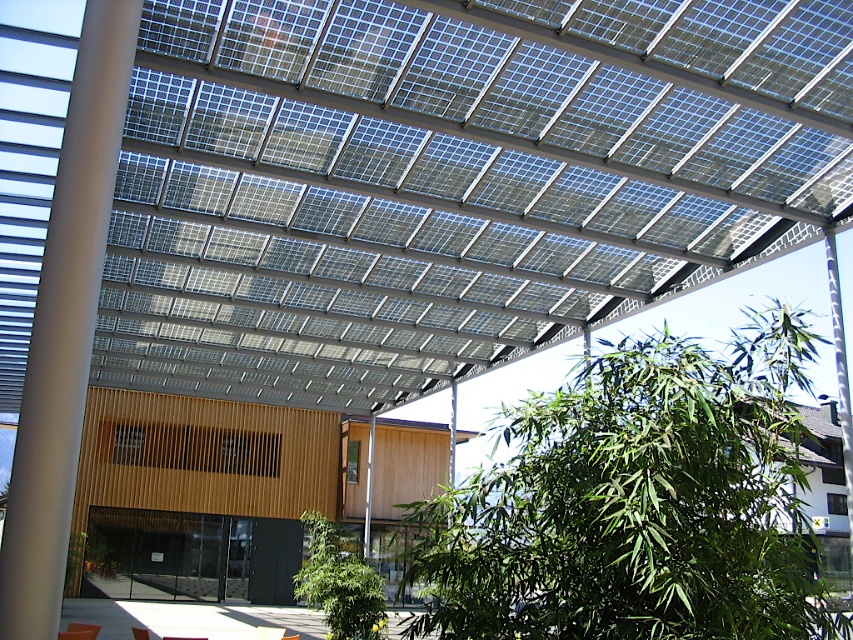
Is point (329, 356) positioned after point (363, 611)?

Yes, point (329, 356) is behind point (363, 611).

Does transparent glass panels at upper center have a greater height compared to green leafy plant at center?

Yes, transparent glass panels at upper center is taller than green leafy plant at center.

Identify the location of transparent glass panels at upper center. (450, 180).

In the scene shown: Who is lower down, white smooth pillar at left or green leafy plant at center?

Positioned lower is green leafy plant at center.

How distant is white smooth pillar at left from green leafy plant at center?

A distance of 35.61 feet exists between white smooth pillar at left and green leafy plant at center.

Is point (39, 509) farther from viewer compared to point (364, 598)?

No.

Identify the location of white smooth pillar at left. (65, 324).

Does green leafy tree at center have a greater height compared to green leafy plant at center?

Correct, green leafy tree at center is much taller as green leafy plant at center.

Does point (646, 492) come behind point (322, 609)?

No, it is in front of (322, 609).

What are the coordinates of `green leafy tree at center` in the screenshot? It's located at (637, 502).